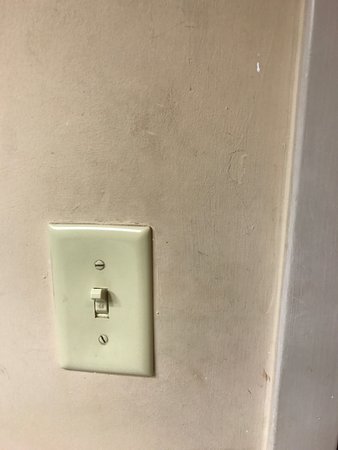
Where is `switch`? The image size is (338, 450). switch is located at coordinates (97, 305).